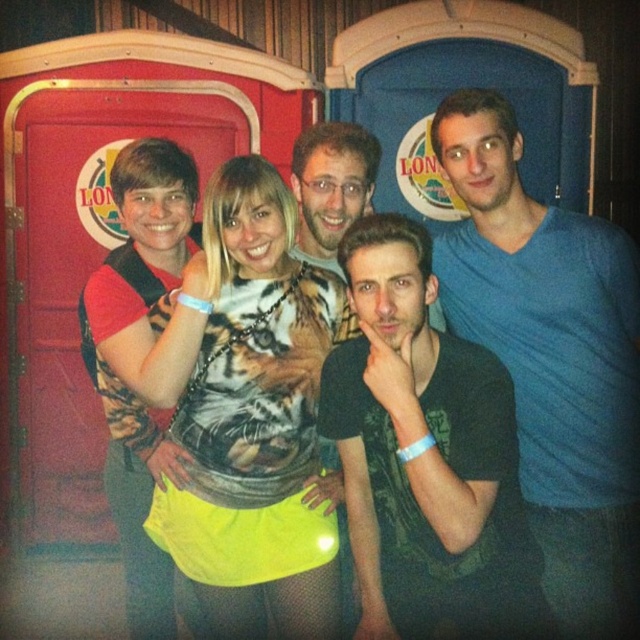
Does blue cotton shirt at center appear under tiger print shirt at center?

Actually, blue cotton shirt at center is above tiger print shirt at center.

Is point (502, 177) in front of point (209, 547)?

No, (502, 177) is further to viewer.

Who is more forward, [536,262] or [252,189]?

Positioned in front is point [252,189].

You are a GUI agent. You are given a task and a screenshot of the screen. Output one action in this format:
    pyautogui.click(x=<x>, y=<y>)
    Task: Click on the blue cotton shirt at center
    The height and width of the screenshot is (640, 640).
    Given the screenshot: What is the action you would take?
    pyautogui.click(x=552, y=356)

Can you confirm if black matte t-shirt at center is positioned to the left of tiger print shirt at center?

No, black matte t-shirt at center is not to the left of tiger print shirt at center.

Is point (428, 465) more distant than point (246, 272)?

No, (428, 465) is in front of (246, 272).

I want to click on black matte t-shirt at center, so (422, 452).

Does blue cotton shirt at center appear under black matte t-shirt at center?

No.

Is blue cotton shirt at center wider than black matte t-shirt at center?

Incorrect, blue cotton shirt at center's width does not surpass black matte t-shirt at center's.

The height and width of the screenshot is (640, 640). I want to click on blue cotton shirt at center, so click(552, 356).